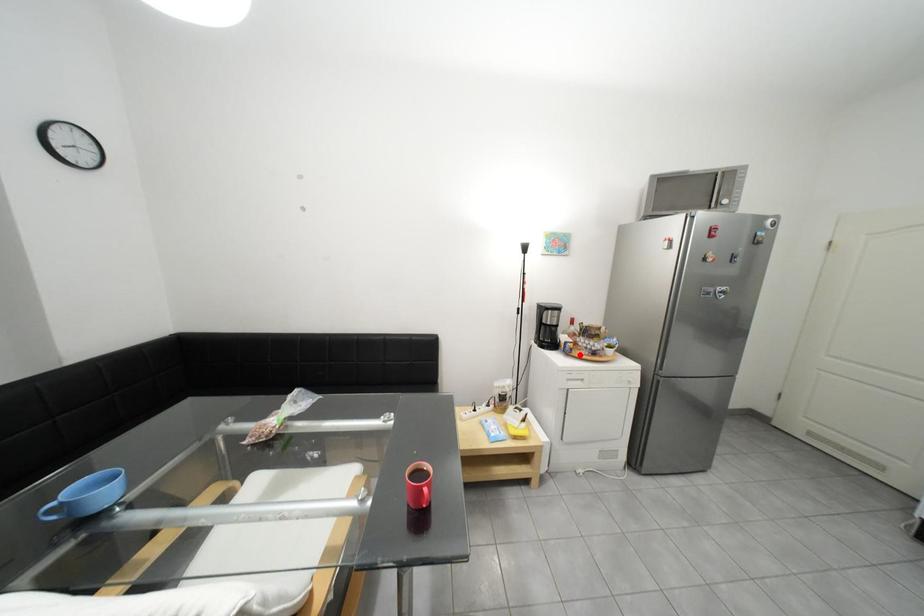
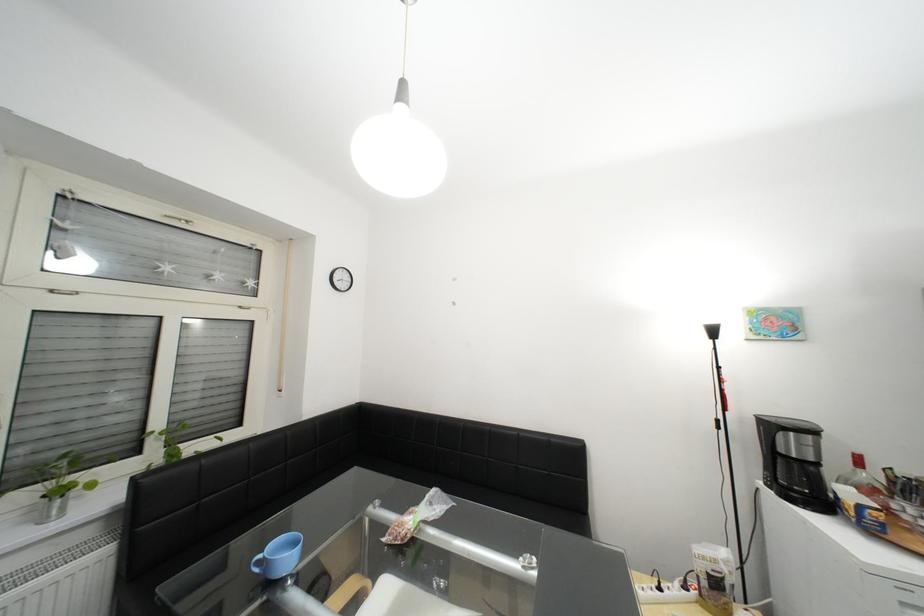
Question: A red point is marked in image1. In image2, is the corresponding 3D point closer to the camera or farther? Reply with the corresponding letter.

Choices:
 (A) The corresponding 3D point is closer.
 (B) The corresponding 3D point is farther.

Answer: (A)